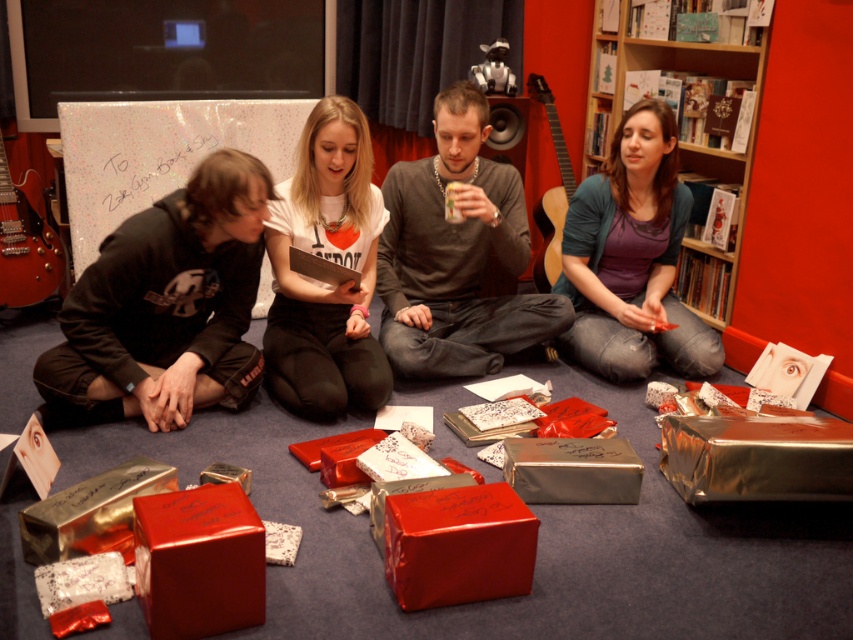
You are taking a photo of the indoor gathering scene. You want to focus on the point at the center of the image. Which of the two points, point (x=402, y=323) or point (x=692, y=323), is closer to the camera and thus in better focus?

Point (x=402, y=323) is closer to the camera than point (x=692, y=323), so it will be in better focus.

You are organizing a clothing donation drive and need to sort items by size. You have two items in front of you, the matte gray sweater at center and the matte purple shirt at center. Which one should you place in the large size bin?

The matte gray sweater at center is bigger than the matte purple shirt at center, so it should be placed in the large size bin.